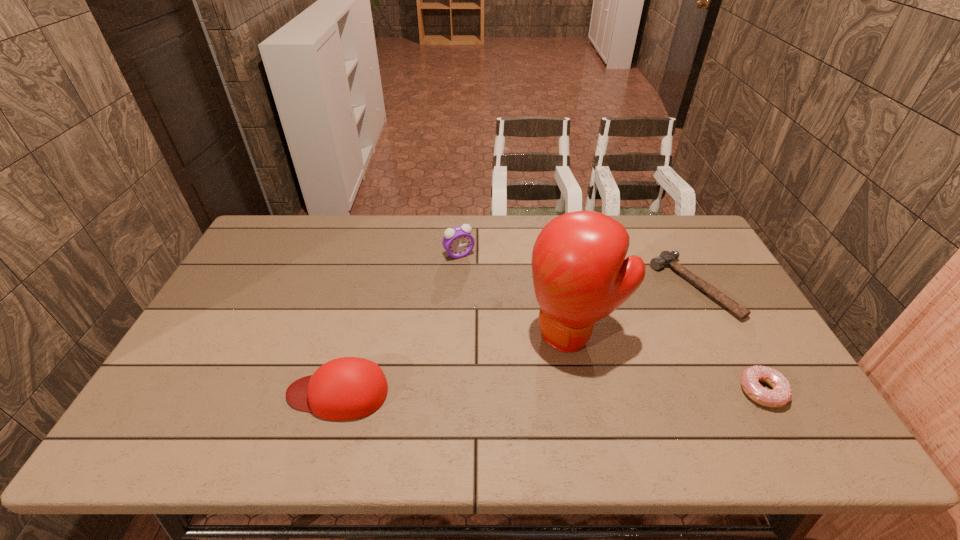
The image size is (960, 540). I want to click on baseball cap, so click(347, 388).

Where is `doughnut`? Image resolution: width=960 pixels, height=540 pixels. doughnut is located at coordinates (781, 394).

Find the location of `alarm clock`. alarm clock is located at coordinates (458, 242).

This screenshot has width=960, height=540. Identify the location of hammer. [666, 259].

Identify the location of the third object from left to right. This screenshot has height=540, width=960. (580, 276).

I want to click on boxing glove, so click(x=580, y=276).

This screenshot has width=960, height=540. I want to click on vacant space located 0.160m on the front-facing side of the leftmost object, so click(223, 393).

Find the location of `vacant space located on the front-facing side of the leftmost object`. vacant space located on the front-facing side of the leftmost object is located at coordinates (259, 393).

This screenshot has width=960, height=540. Find the location of `vacant point located on the front-facing side of the leftmost object`. vacant point located on the front-facing side of the leftmost object is located at coordinates pyautogui.click(x=214, y=393).

This screenshot has height=540, width=960. I want to click on free space located on the left of the doughnut, so click(x=683, y=392).